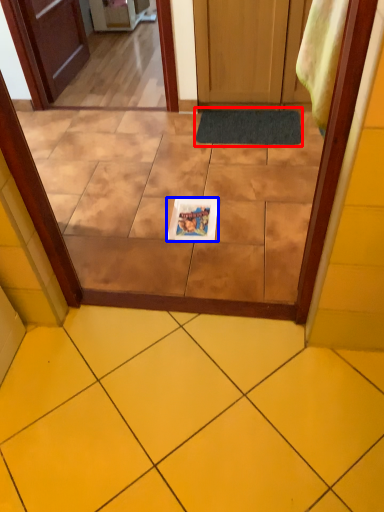
Question: Which object appears closest to the camera in this image, doormat (highlighted by a red box) or magazine (highlighted by a blue box)?

Choices:
 (A) doormat
 (B) magazine

Answer: (B)